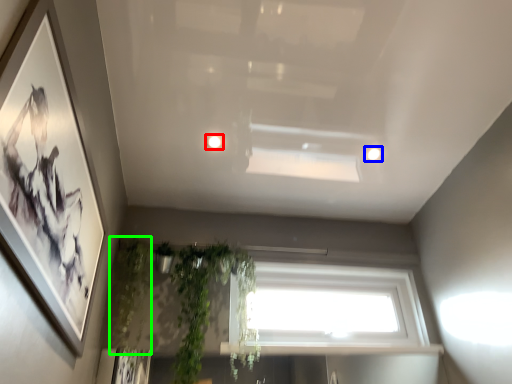
Question: Based on their relative distances, which object is nearer to lighting (highlighted by a red box)? Choose from lighting (highlighted by a blue box) and plant (highlighted by a green box).

Choices:
 (A) lighting
 (B) plant

Answer: (A)